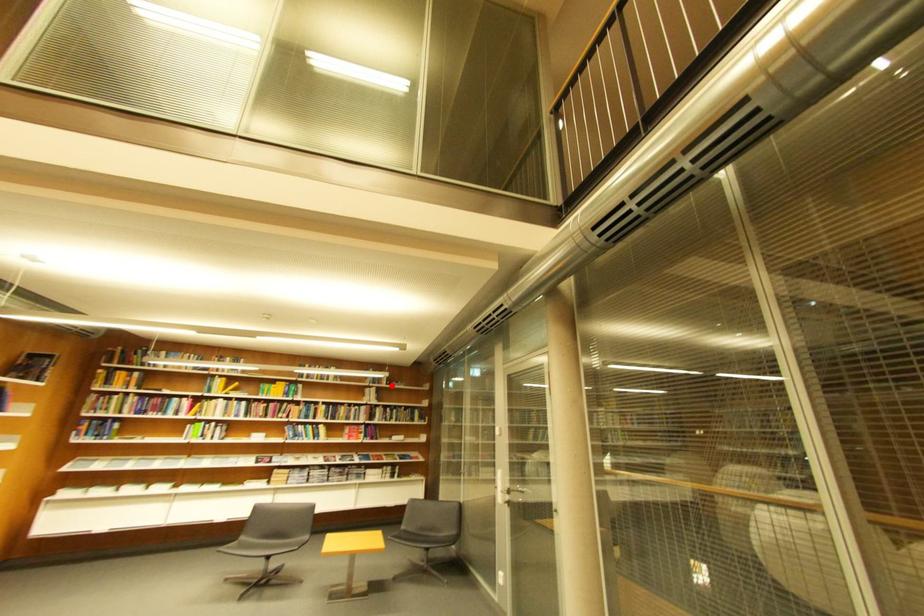
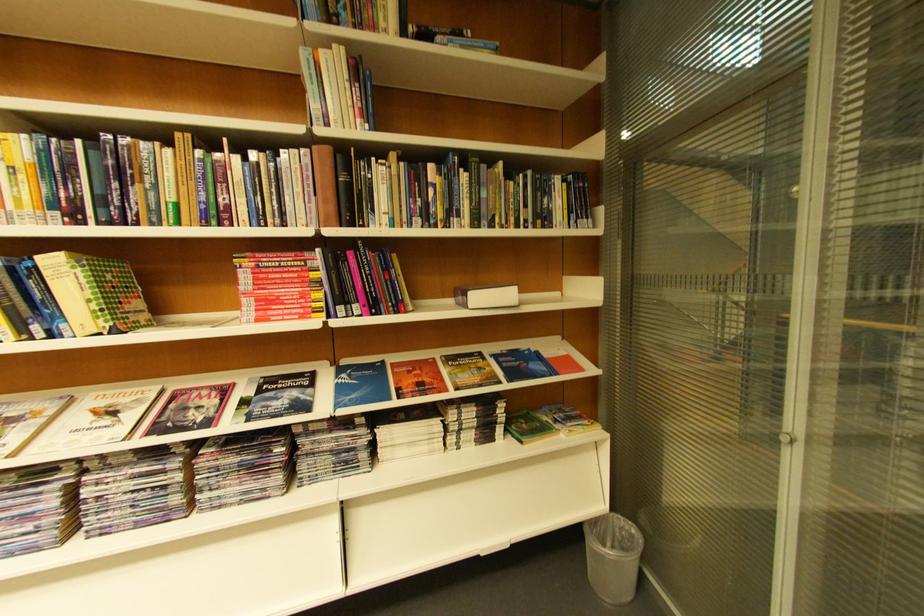
The point at the highlighted location is marked in the first image. Where is the corresponding point in the second image?

(384, 31)